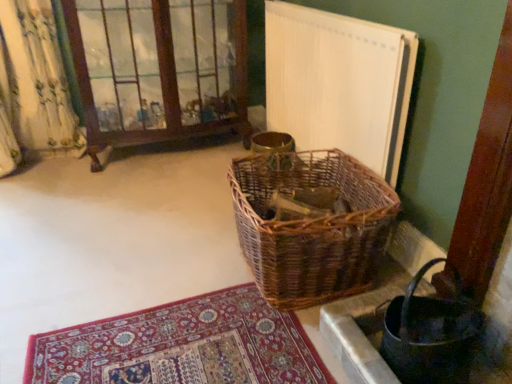
The width and height of the screenshot is (512, 384). What are the coordinates of `free space between brown wooden window frame at upper left and woven brown picnic basket at center` in the screenshot? It's located at (178, 205).